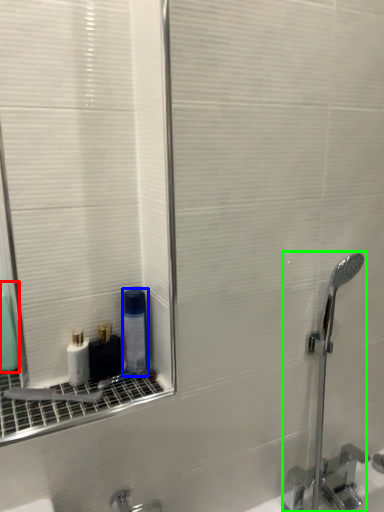
Question: Based on their relative distances, which object is farther from mouthwash (highlighted by a red box)? Choose from mouthwash (highlighted by a blue box) and faucet (highlighted by a green box).

Choices:
 (A) mouthwash
 (B) faucet

Answer: (B)